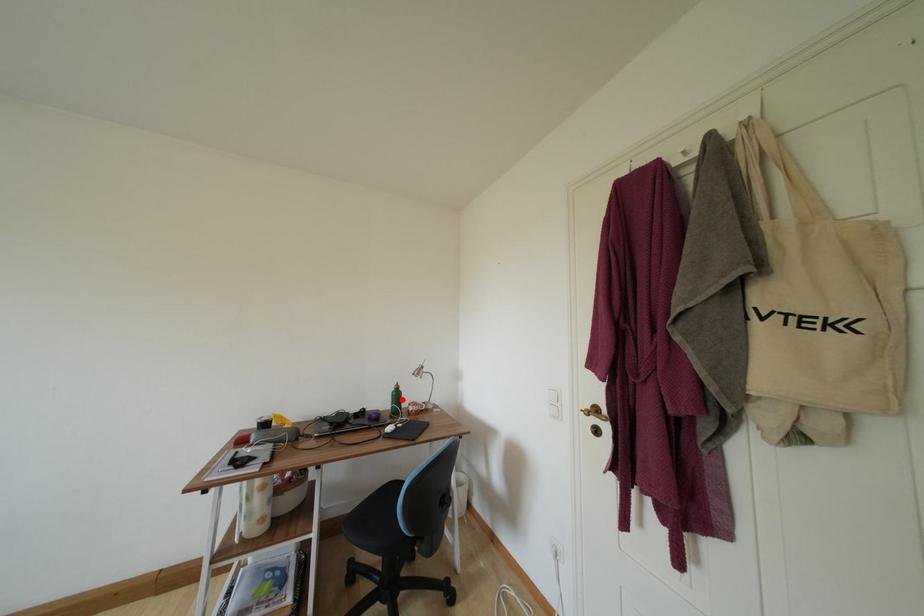
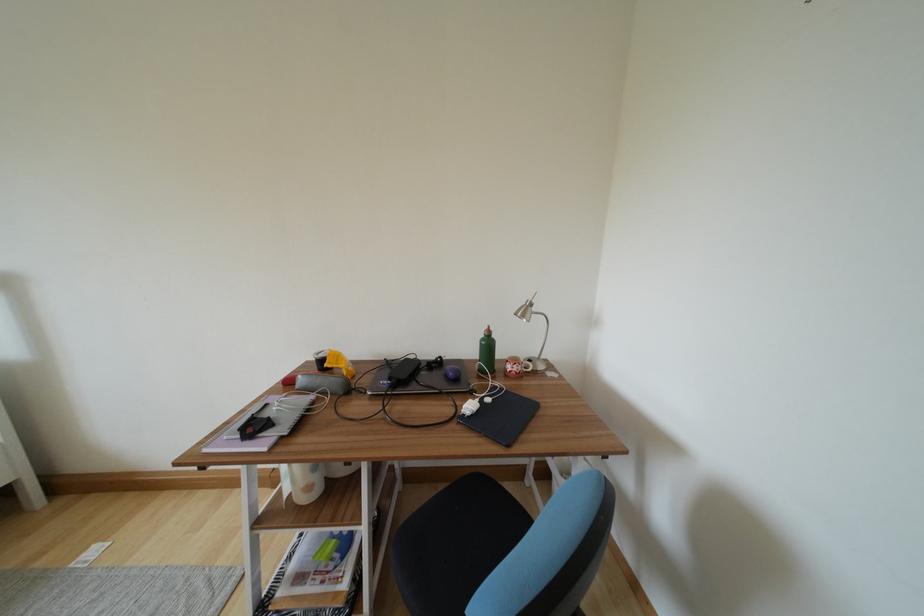
Question: I am providing you with two images of the same scene from different viewpoints. In image1, a red point is highlighted. Considering the same 3D point in image2, which of the following is correct?

Choices:
 (A) It is closer
 (B) It is farther

Answer: (A)